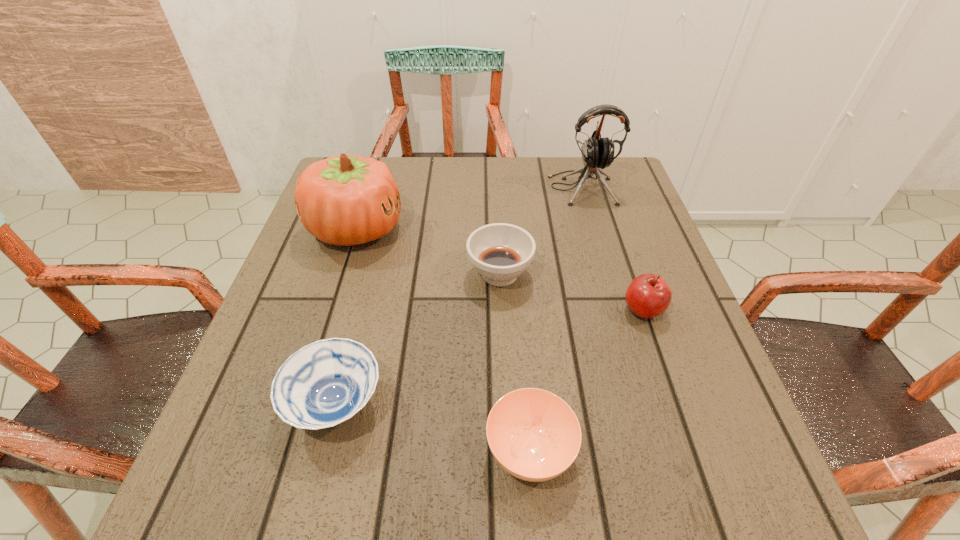
The image size is (960, 540). Find the location of `free location that satisfies the following two spatial constraints: 1. on the back side of the farthest soup bowl; 2. on the side of the fifth shortest object with the cute face`. free location that satisfies the following two spatial constraints: 1. on the back side of the farthest soup bowl; 2. on the side of the fifth shortest object with the cute face is located at coordinates (497, 229).

Locate an element on the screen. This screenshot has width=960, height=540. free spot that satisfies the following two spatial constraints: 1. on the side of the apple with the cute face; 2. on the right side of the second tallest object is located at coordinates (331, 309).

I want to click on vacant space that satisfies the following two spatial constraints: 1. on the front side of the apple; 2. on the left side of the farthest soup bowl, so click(501, 309).

At what (x,y) coordinates should I click in order to perform the action: click on vacant region that satisfies the following two spatial constraints: 1. on the side of the pumpkin with the cute face; 2. on the back side of the farthest soup bowl. Please return your answer as a coordinate pair (x, y). The width and height of the screenshot is (960, 540). Looking at the image, I should click on (342, 274).